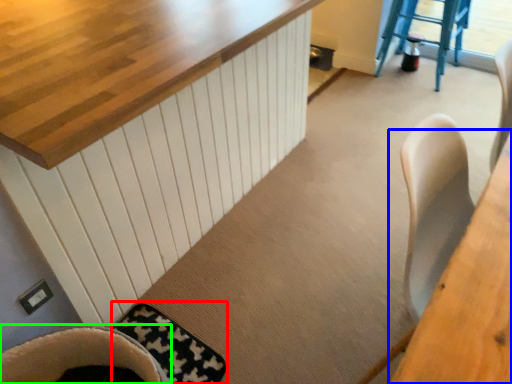
Question: Considering the real-world distances, which object is closest to mat (highlighted by a red box)? table (highlighted by a blue box) or chair (highlighted by a green box).

Choices:
 (A) table
 (B) chair

Answer: (B)